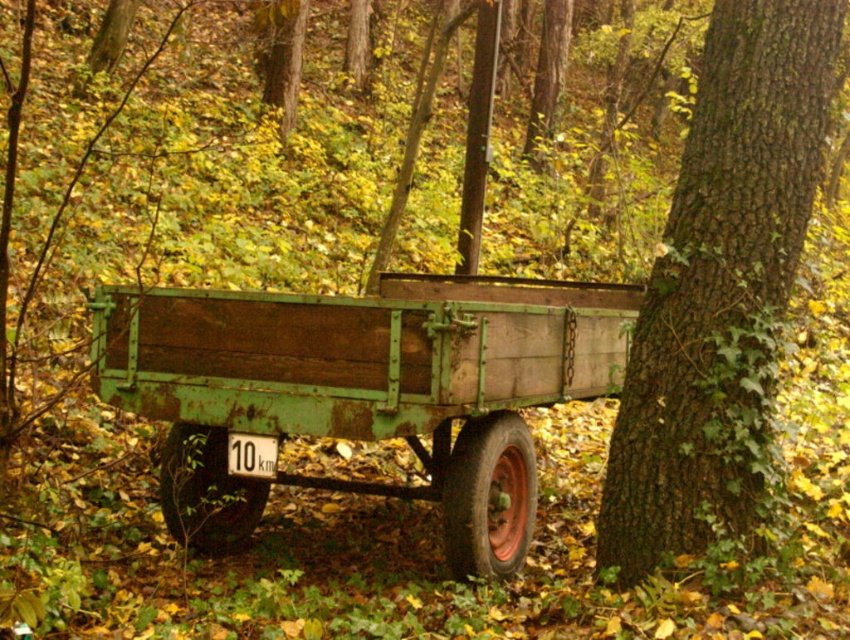
Between point (394, 376) and point (270, 449), which one is positioned behind?

The point (270, 449) is more distant.

Can you confirm if rusty wood wagon at center is taller than white plastic sign at center?

Indeed, rusty wood wagon at center has a greater height compared to white plastic sign at center.

Which is behind, point (98, 301) or point (268, 442)?

The point (98, 301) is behind.

The height and width of the screenshot is (640, 850). I want to click on rusty wood wagon at center, so click(363, 390).

Which is in front, point (811, 196) or point (242, 458)?

Positioned in front is point (811, 196).

What do you see at coordinates (720, 289) in the screenshot?
I see `green rough bark tree at center right` at bounding box center [720, 289].

Locate an element on the screen. The width and height of the screenshot is (850, 640). green rough bark tree at center right is located at coordinates (720, 289).

How far apart are rusty wood wagon at center and green rough bark tree at center right?

The distance of rusty wood wagon at center from green rough bark tree at center right is 4.35 feet.

Looking at this image, between rusty wood wagon at center and green rough bark tree at center right, which one appears on the left side from the viewer's perspective?

From the viewer's perspective, rusty wood wagon at center appears more on the left side.

The width and height of the screenshot is (850, 640). Describe the element at coordinates (363, 390) in the screenshot. I see `rusty wood wagon at center` at that location.

The width and height of the screenshot is (850, 640). I want to click on rusty wood wagon at center, so click(x=363, y=390).